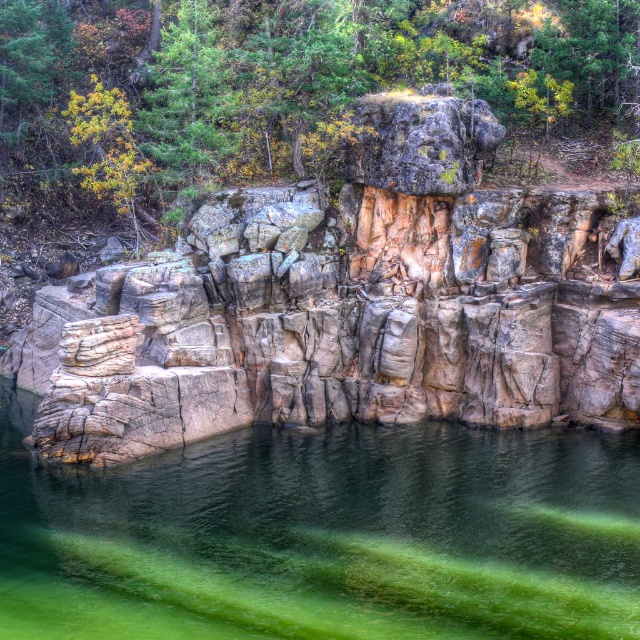
You are standing on the shore looking at the rustic stone cliff at center and the green leafy tree at upper center. Which object appears taller in the scene?

The green leafy tree at upper center appears taller than the rustic stone cliff at center in the scene.

You are standing at the edge of the cliff in the image. You see a point marked at coordinates (348, 305). Based on the scene description, what natural feature does this point most likely represent?

The point at coordinates (348, 305) corresponds to the rustic stone cliff at center, as described in the scene.

You are a geologist examining the image. You notice the rustic stone cliff at center and the green translucent water at center. Based on their positions, which object is positioned higher in the scene?

The rustic stone cliff at center is located above the green translucent water at center, so it is positioned higher in the scene.